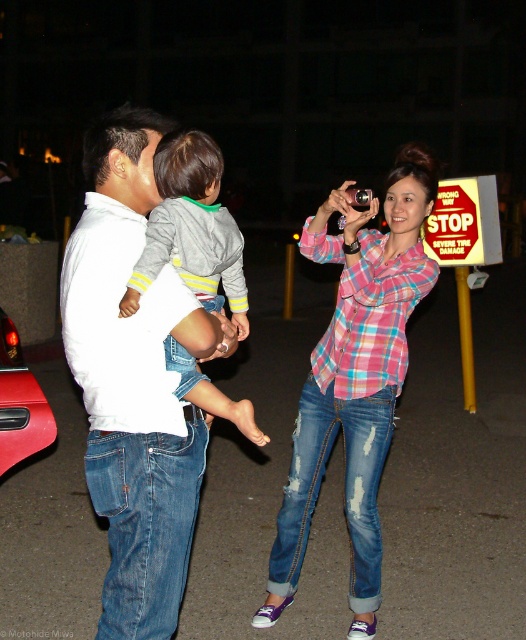
Question: Is pink plaid shirt at center to the left of gray fleece sweater at center from the viewer's perspective?

Choices:
 (A) no
 (B) yes

Answer: (A)

Question: Based on their relative distances, which object is farther from the white cotton shirt at center?

Choices:
 (A) shiny red car at lower left
 (B) gray fleece sweater at center

Answer: (A)

Question: Which object is the farthest from the shiny red car at lower left?

Choices:
 (A) pink plaid shirt at center
 (B) white cotton shirt at center
 (C) gray fleece sweater at center

Answer: (C)

Question: Among these objects, which one is nearest to the camera?

Choices:
 (A) shiny red car at lower left
 (B) pink plaid shirt at center
 (C) gray fleece sweater at center

Answer: (C)

Question: Does white cotton shirt at center come in front of gray fleece sweater at center?

Choices:
 (A) yes
 (B) no

Answer: (A)

Question: Where is gray fleece sweater at center located in relation to shiny red car at lower left in the image?

Choices:
 (A) right
 (B) left

Answer: (A)